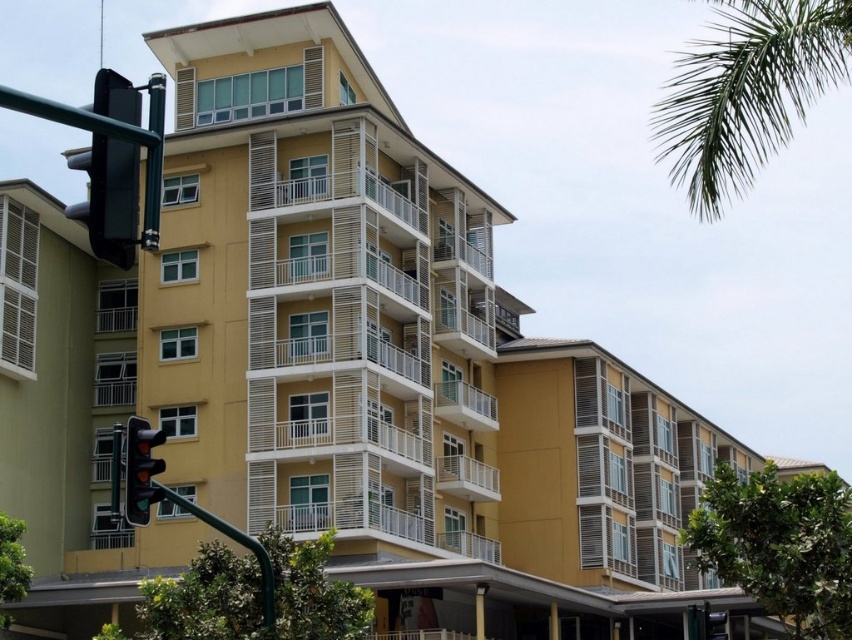
Is black plastic traffic light at left smaller than matte black traffic light at left?

Actually, black plastic traffic light at left might be larger than matte black traffic light at left.

Does black plastic traffic light at left come in front of matte black traffic light at left?

Yes, black plastic traffic light at left is closer to the viewer.

The height and width of the screenshot is (640, 852). What do you see at coordinates (108, 196) in the screenshot?
I see `black plastic traffic light at left` at bounding box center [108, 196].

This screenshot has height=640, width=852. Find the location of `black plastic traffic light at left`. black plastic traffic light at left is located at coordinates (108, 196).

Does green leafy palm at upper right lie behind black plastic traffic light at left?

That is True.

Is point (701, 106) in front of point (107, 97)?

No, (701, 106) is further to viewer.

Locate an element on the screen. This screenshot has width=852, height=640. green leafy palm at upper right is located at coordinates (747, 92).

Between point (751, 77) and point (131, 449), which one is positioned in front?

Point (131, 449)

Is point (770, 12) farther from viewer compared to point (148, 428)?

That is True.

This screenshot has width=852, height=640. In order to click on green leafy palm at upper right in this screenshot , I will do `click(747, 92)`.